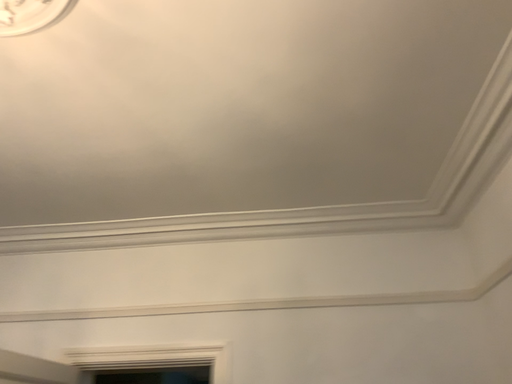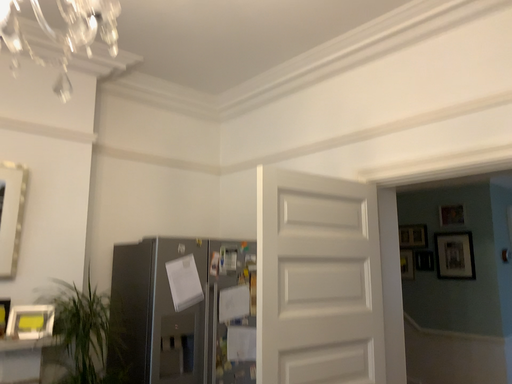
Question: Which way did the camera rotate in the video?

Choices:
 (A) rotated right
 (B) rotated left

Answer: (B)